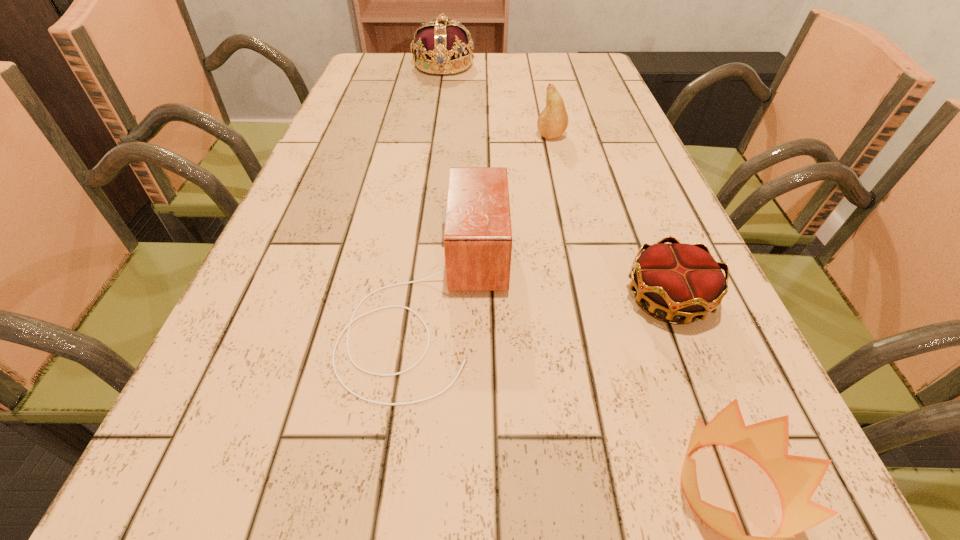
You are a GUI agent. You are given a task and a screenshot of the screen. Output one action in this format:
    pyautogui.click(x=<x>, y=<y>)
    Task: Click on the object positioned at the far edge
    This screenshot has height=540, width=960.
    Given the screenshot: What is the action you would take?
    pyautogui.click(x=440, y=46)

Find the location of `object present at the right edge`. object present at the right edge is located at coordinates (683, 280).

Image resolution: width=960 pixels, height=540 pixels. Identify the location of vacant space at the left edge. (356, 105).

Find the location of a particular element. This screenshot has height=540, width=960. free space at the right edge of the desktop is located at coordinates (625, 195).

At what (x,y) coordinates should I click in order to perform the action: click on vacant point at the far left corner. Please return your answer as a coordinate pair (x, y). The height and width of the screenshot is (540, 960). Looking at the image, I should click on (378, 57).

At what (x,y) coordinates should I click in order to perform the action: click on free space between the fourth nearest object and the second nearest crown. Please return your answer as a coordinate pair (x, y). The image size is (960, 540). Looking at the image, I should click on (610, 217).

Identify the location of free spot between the leftmost crown and the second nearest crown. The image size is (960, 540). (556, 182).

Identify the location of vacant space that is in between the radio receiver and the second farthest crown. tap(549, 296).

Where is `free spot between the pear and the second farthest crown`? This screenshot has width=960, height=540. free spot between the pear and the second farthest crown is located at coordinates (610, 217).

The height and width of the screenshot is (540, 960). Identify the location of object that is the third closest to the nearest object. (552, 122).